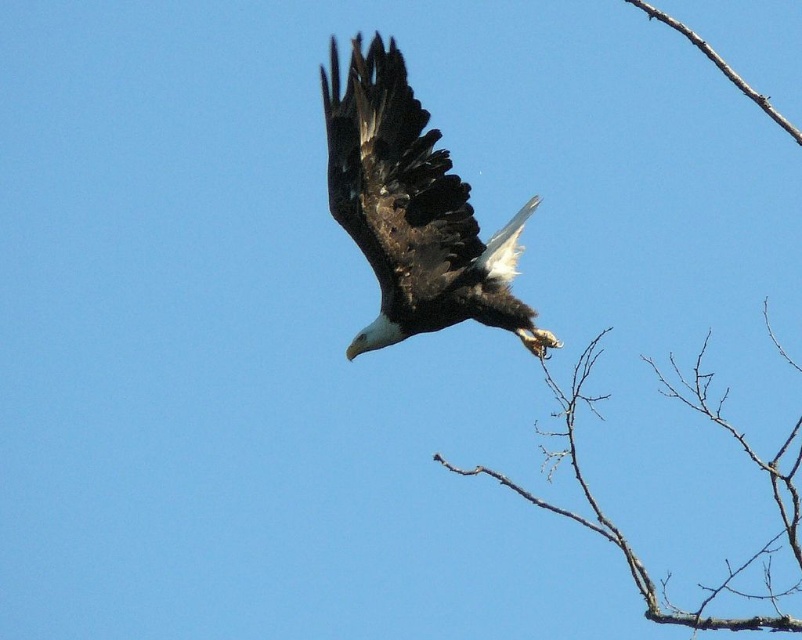
Question: Among these objects, which one is nearest to the camera?

Choices:
 (A) brown rough branch at upper right
 (B) dark brown feathers at center
 (C) brown twig at upper right

Answer: (C)

Question: Which of these objects is positioned closest to the dark brown feathers at center?

Choices:
 (A) brown twig at upper right
 (B) brown rough branch at upper right

Answer: (A)

Question: Does brown twig at upper right have a greater width compared to brown rough branch at upper right?

Choices:
 (A) yes
 (B) no

Answer: (A)

Question: Which object appears farthest from the camera in this image?

Choices:
 (A) dark brown feathers at center
 (B) brown rough branch at upper right
 (C) brown twig at upper right

Answer: (A)

Question: Does dark brown feathers at center appear on the right side of brown rough branch at upper right?

Choices:
 (A) no
 (B) yes

Answer: (A)

Question: Is dark brown feathers at center bigger than brown twig at upper right?

Choices:
 (A) yes
 (B) no

Answer: (B)